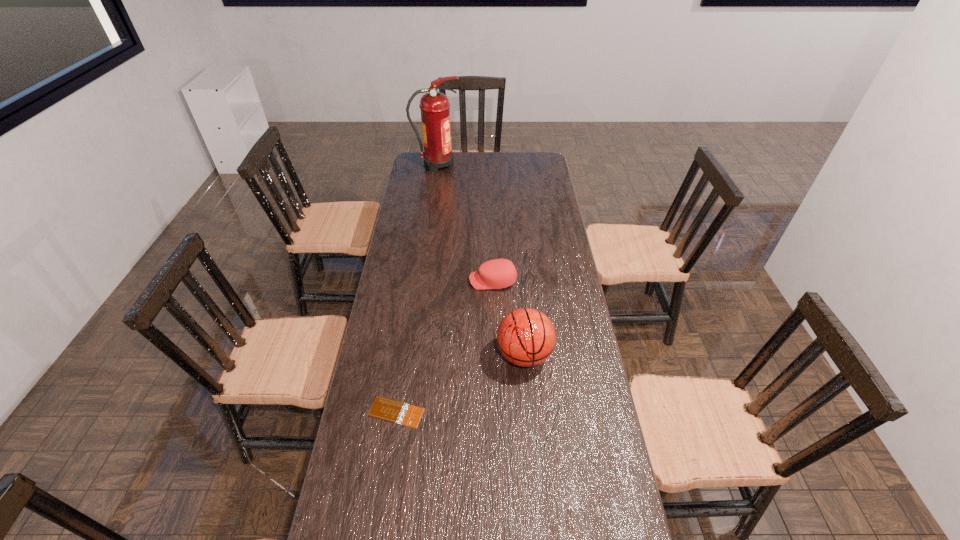
At what (x,y) coordinates should I click in order to perform the action: click on free spot between the third tallest object and the tallest object. Please return your answer as a coordinate pair (x, y). Looking at the image, I should click on (465, 223).

Locate an element on the screen. This screenshot has width=960, height=540. object that ranks as the second closest to the fire extinguisher is located at coordinates (526, 337).

What are the coordinates of `object identified as the third closest to the tallest object` in the screenshot? It's located at (386, 409).